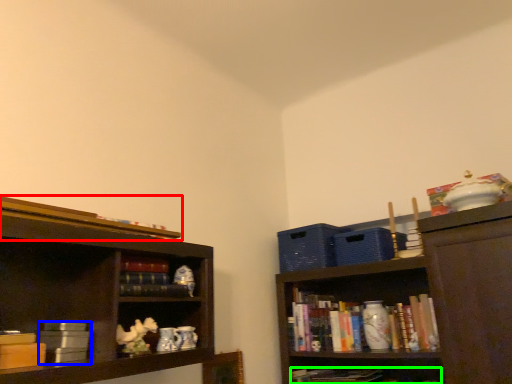
Question: Estimate the real-world distances between objects in this image. Which object is closer to book (highlighted by a red box), book (highlighted by a blue box) or book (highlighted by a green box)?

Choices:
 (A) book
 (B) book

Answer: (A)